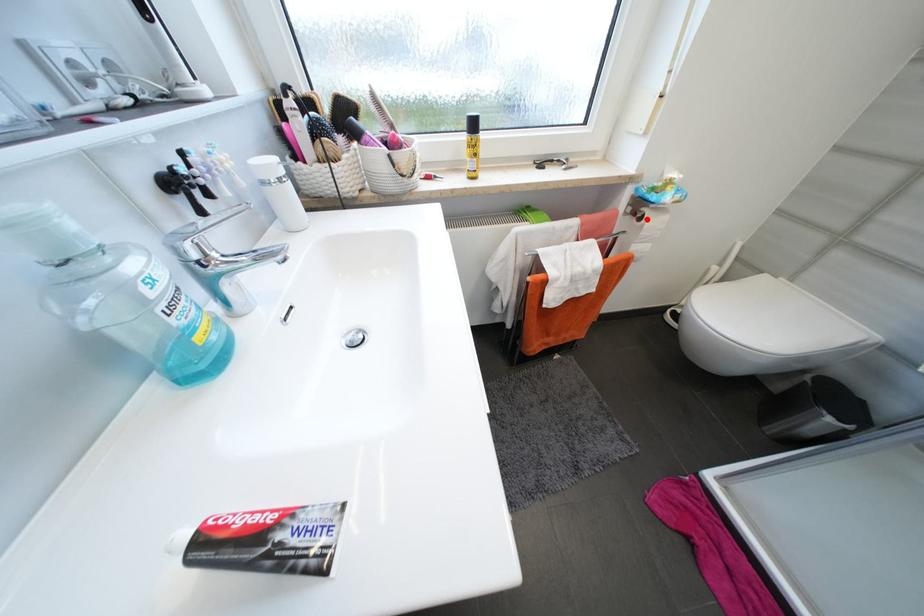
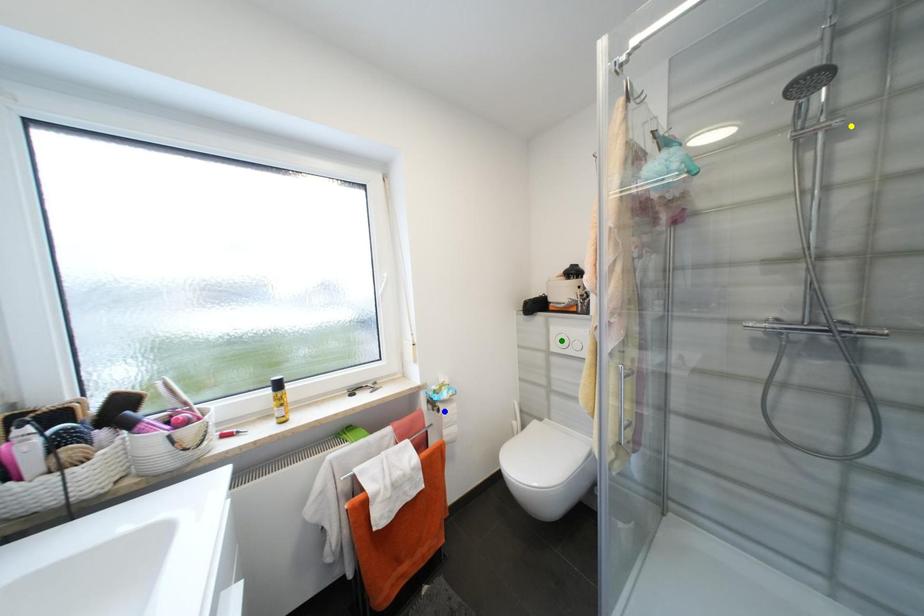
Question: I am providing you with two images of the same scene from different viewpoints. A red point is marked on the first image. You are given multiple points on the second image. Which point in image 2 is actually the same real-world point as the red point in image 1?

Choices:
 (A) blue point
 (B) green point
 (C) yellow point

Answer: (A)